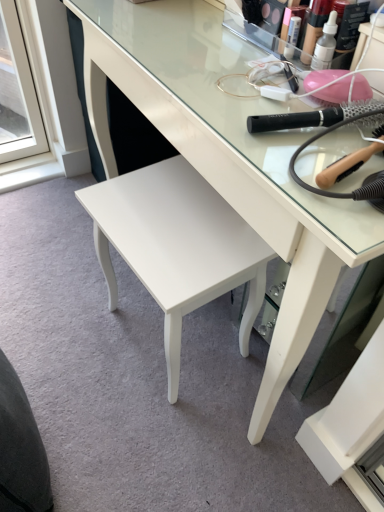
Question: From the image's perspective, is wooden-handled hairbrush at upper right, marked as the 2th brush in a top-to-bottom arrangement, located above translucent plastic makeup at upper center?

Choices:
 (A) yes
 (B) no

Answer: (B)

Question: Is wooden-handled hairbrush at upper right, marked as the 2th brush in a top-to-bottom arrangement, next to translucent plastic makeup at upper center?

Choices:
 (A) yes
 (B) no

Answer: (B)

Question: Considering the relative sizes of wooden-handled hairbrush at upper right, marked as the 2th brush in a top-to-bottom arrangement, and translucent plastic makeup at upper center in the image provided, is wooden-handled hairbrush at upper right, marked as the 2th brush in a top-to-bottom arrangement, shorter than translucent plastic makeup at upper center?

Choices:
 (A) no
 (B) yes

Answer: (B)

Question: From a real-world perspective, does wooden-handled hairbrush at upper right, acting as the 1th brush starting from the bottom, sit lower than translucent plastic makeup at upper center?

Choices:
 (A) yes
 (B) no

Answer: (A)

Question: Considering the relative sizes of wooden-handled hairbrush at upper right, acting as the 1th brush starting from the bottom, and translucent plastic makeup at upper center in the image provided, is wooden-handled hairbrush at upper right, acting as the 1th brush starting from the bottom, wider than translucent plastic makeup at upper center?

Choices:
 (A) no
 (B) yes

Answer: (B)

Question: Do you think dark gray fabric swivel chair at lower left is within translucent plastic makeup at upper center, or outside of it?

Choices:
 (A) inside
 (B) outside

Answer: (B)

Question: Considering their positions, is dark gray fabric swivel chair at lower left located in front of or behind translucent plastic makeup at upper center?

Choices:
 (A) behind
 (B) front

Answer: (B)

Question: From a real-world perspective, relative to translucent plastic makeup at upper center, is dark gray fabric swivel chair at lower left vertically above or below?

Choices:
 (A) below
 (B) above

Answer: (A)

Question: Is dark gray fabric swivel chair at lower left to the left or to the right of translucent plastic makeup at upper center in the image?

Choices:
 (A) left
 (B) right

Answer: (A)

Question: From their relative heights in the image, would you say white glossy stool at center is taller or shorter than dark gray fabric swivel chair at lower left?

Choices:
 (A) short
 (B) tall

Answer: (A)

Question: From a real-world perspective, is white glossy stool at center physically located above or below dark gray fabric swivel chair at lower left?

Choices:
 (A) above
 (B) below

Answer: (B)

Question: Is white glossy stool at center wider or thinner than dark gray fabric swivel chair at lower left?

Choices:
 (A) thin
 (B) wide

Answer: (B)

Question: Is point (122, 243) positioned closer to the camera than point (16, 467)?

Choices:
 (A) farther
 (B) closer

Answer: (A)

Question: Considering the positions of black plastic hairbrush at upper right, which is counted as the first brush, starting from the top, and white glossy stool at center in the image, is black plastic hairbrush at upper right, which is counted as the first brush, starting from the top, wider or thinner than white glossy stool at center?

Choices:
 (A) wide
 (B) thin

Answer: (B)

Question: From a real-world perspective, is black plastic hairbrush at upper right, the second brush when ordered from bottom to top, physically located above or below white glossy stool at center?

Choices:
 (A) below
 (B) above

Answer: (B)